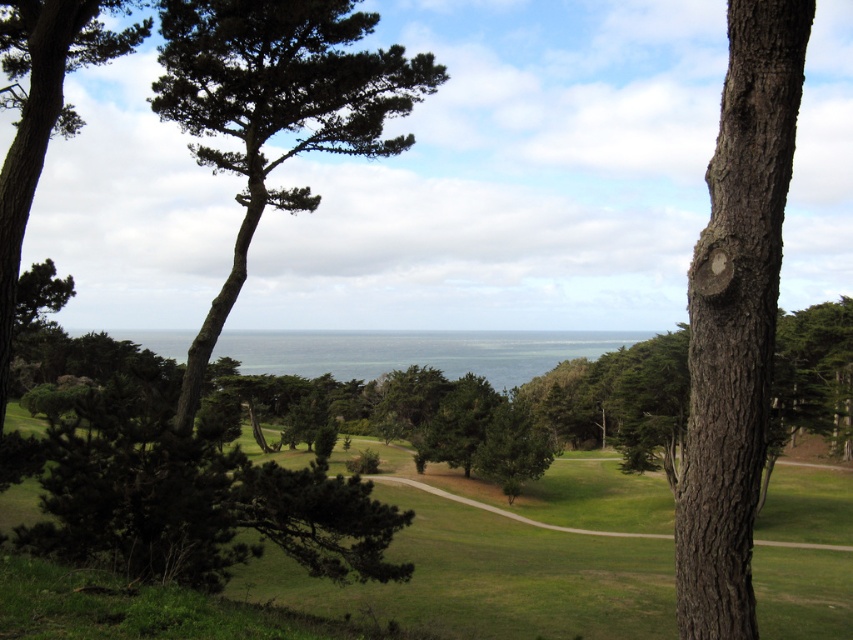
Question: Which point is farther to the camera?

Choices:
 (A) (85, 42)
 (B) (787, 67)

Answer: (A)

Question: Which object is the farthest from the green grassy golf course at center?

Choices:
 (A) brown rough bark tree trunk at right
 (B) green needle-like leaves at center
 (C) green matte tree at center
 (D) green rough bark tree at left

Answer: (D)

Question: Among these objects, which one is nearest to the camera?

Choices:
 (A) green grassy golf course at center
 (B) green needle-like leaves at center
 (C) green rough bark tree at left

Answer: (A)

Question: Is brown rough bark tree trunk at right to the left of green grassy golf course at center from the viewer's perspective?

Choices:
 (A) no
 (B) yes

Answer: (A)

Question: Is brown rough bark tree trunk at right below green grassy golf course at center?

Choices:
 (A) no
 (B) yes

Answer: (A)

Question: In this image, where is green grassy golf course at center located relative to green rough bark tree at left?

Choices:
 (A) left
 (B) right

Answer: (B)